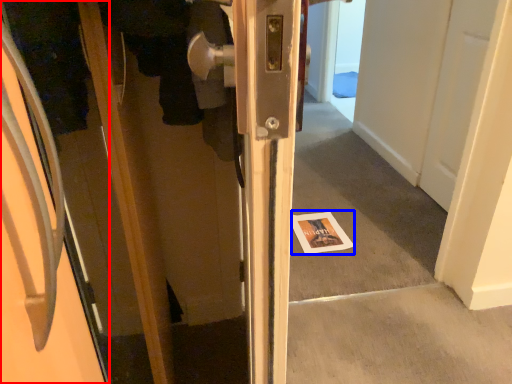
Question: Which object is closer to the camera taking this photo, door (highlighted by a red box) or magazine (highlighted by a blue box)?

Choices:
 (A) door
 (B) magazine

Answer: (A)